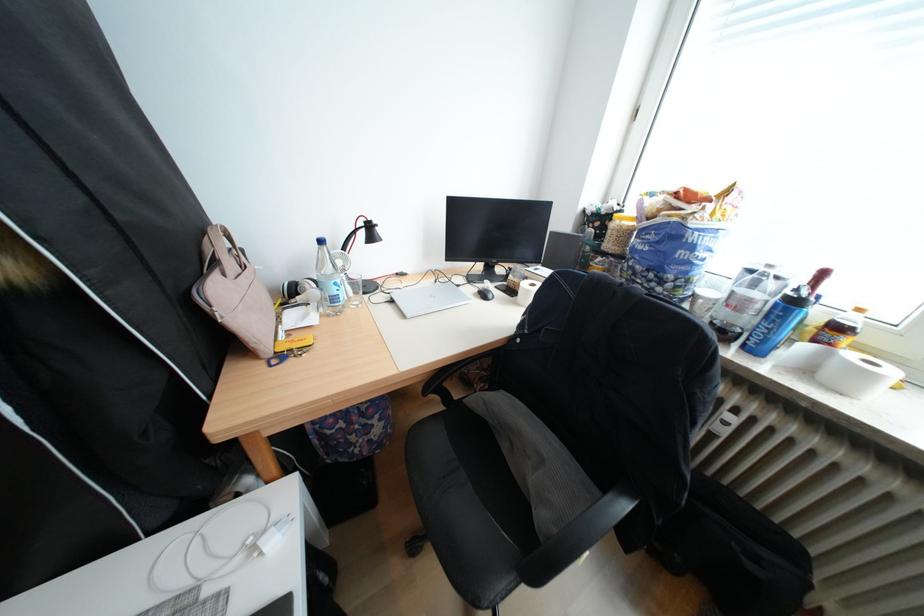
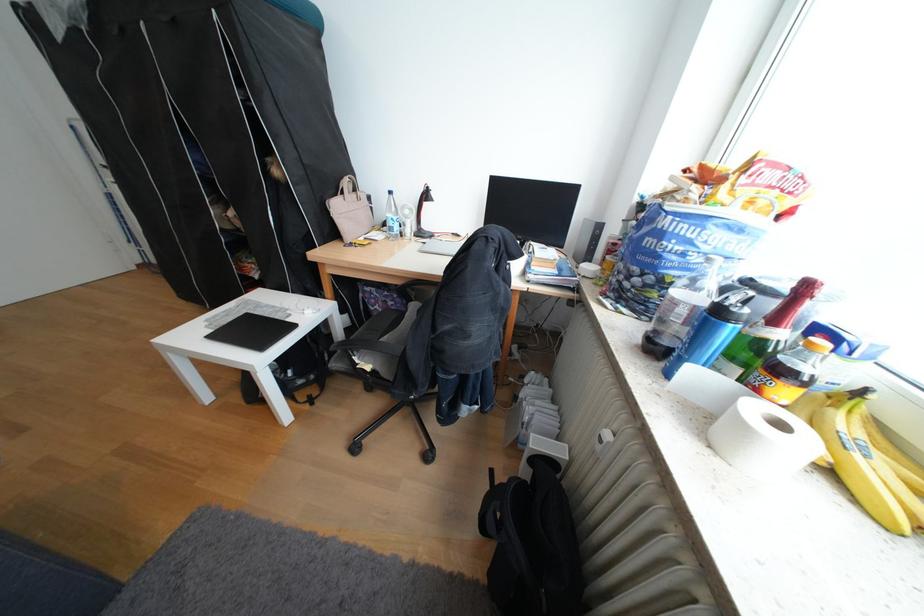
In the second image, find the point that corresponds to point 827,379 in the first image.

(721, 424)